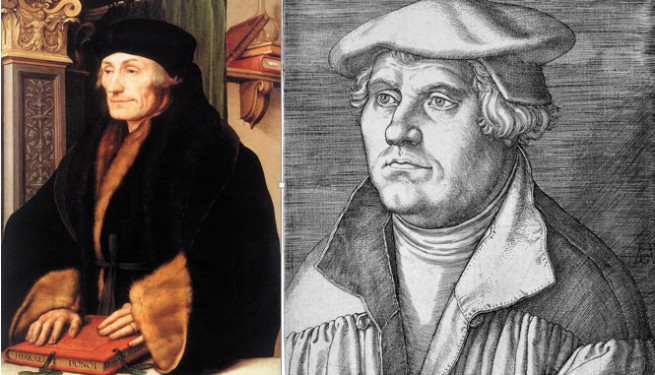
The height and width of the screenshot is (375, 655). Find the location of `robe`. robe is located at coordinates (214, 228).